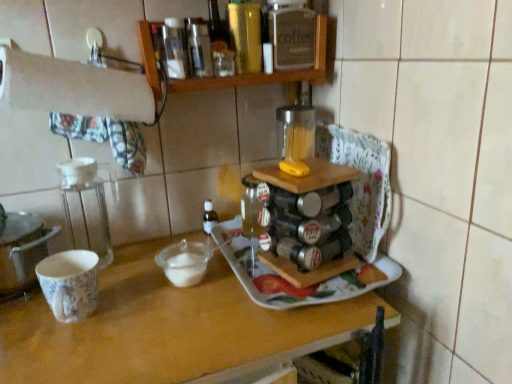
Question: Is transparent glass mixing bowl at center taller or shorter than white paper towel at upper left?

Choices:
 (A) tall
 (B) short

Answer: (B)

Question: Is transparent glass mixing bowl at center in front of or behind white paper towel at upper left in the image?

Choices:
 (A) behind
 (B) front

Answer: (A)

Question: Based on their relative distances, which object is nearer to the metallic gold bottle at upper center?

Choices:
 (A) wooden spice rack at upper center
 (B) white ceramic tray at center
 (C) wooden tray at center
 (D) white paper towel at upper left
 (E) transparent plastic container at left

Answer: (A)

Question: Which object is positioned closest to the wooden tray at center?

Choices:
 (A) white ceramic tray at center
 (B) white paper towel at upper left
 (C) porcelain floral mug at left
 (D) transparent plastic container at left
 (E) metallic silver spice rack at center

Answer: (A)